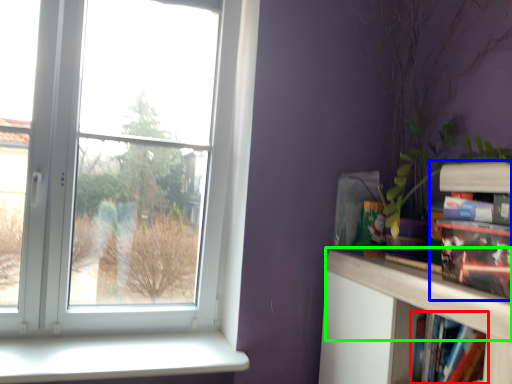
Question: Which object is the farthest from book (highlighted by a red box)? Choose among these: book (highlighted by a blue box) or mantle (highlighted by a green box).

Choices:
 (A) book
 (B) mantle

Answer: (A)